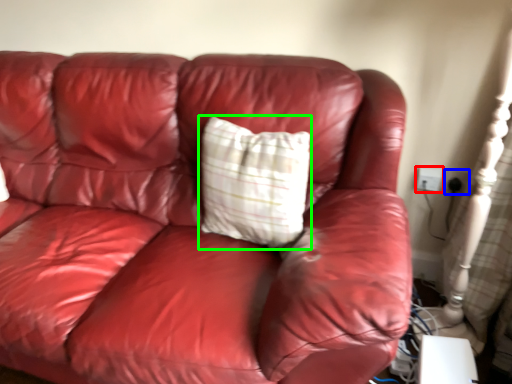
Question: Which is farther away from electric outlet (highlighted by a red box)? electric outlet (highlighted by a blue box) or pillow (highlighted by a green box)?

Choices:
 (A) electric outlet
 (B) pillow

Answer: (B)